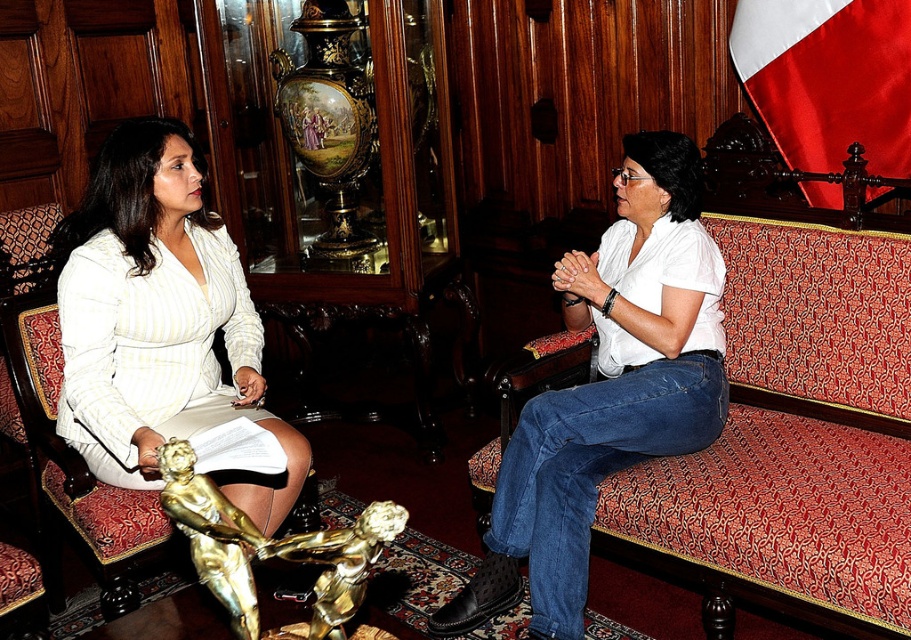
Is red velvet couch at right taller than gold polished statue at lower left?

Indeed, red velvet couch at right has a greater height compared to gold polished statue at lower left.

Is the position of red velvet couch at right more distant than that of gold polished statue at lower left?

Yes, it is behind gold polished statue at lower left.

The height and width of the screenshot is (640, 911). Describe the element at coordinates (794, 435) in the screenshot. I see `red velvet couch at right` at that location.

Find the location of a particular element. red velvet couch at right is located at coordinates (794, 435).

Based on the photo, measure the distance from red velvet couch at right to white striped fabric skirt at left.

They are 1.49 meters apart.

Can you confirm if red velvet couch at right is wider than white striped fabric skirt at left?

Yes, red velvet couch at right is wider than white striped fabric skirt at left.

Which is in front, point (774, 275) or point (120, 243)?

Positioned in front is point (120, 243).

Find the location of a particular element. red velvet couch at right is located at coordinates (794, 435).

Who is higher up, white cotton shirt at center or white striped fabric skirt at left?

white striped fabric skirt at left

Which is in front, point (517, 592) or point (128, 268)?

Positioned in front is point (128, 268).

At what (x,y) coordinates should I click in order to perform the action: click on white cotton shirt at center. Please return your answer as a coordinate pair (x, y). This screenshot has width=911, height=640. Looking at the image, I should click on (608, 390).